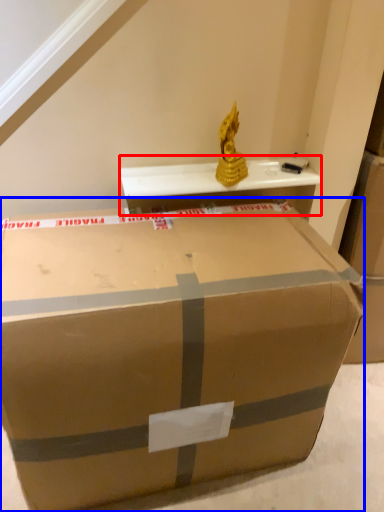
Question: Which of the following is the farthest to the observer, table (highlighted by a red box) or box (highlighted by a blue box)?

Choices:
 (A) table
 (B) box

Answer: (A)